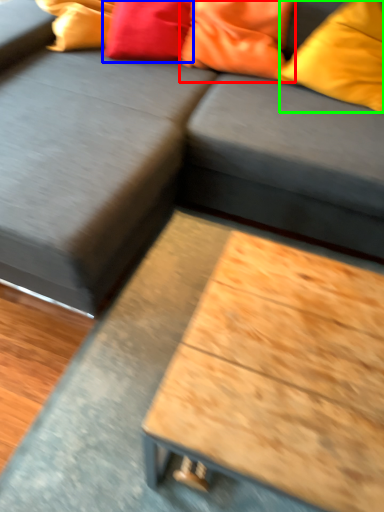
Question: Which object is positioned closest to pillow (highlighted by a red box)? Select from pillow (highlighted by a blue box) and pillow (highlighted by a green box).

Choices:
 (A) pillow
 (B) pillow

Answer: (A)